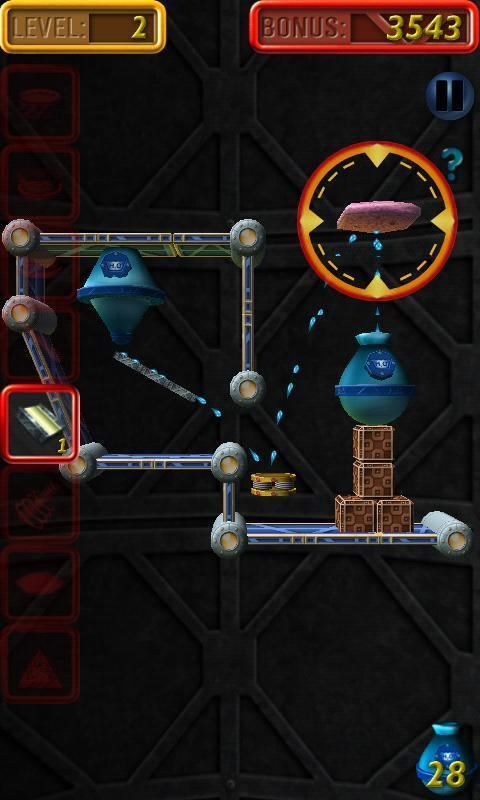
Find the location of a particular element. The width and height of the screenshot is (480, 800). pot is located at coordinates (115, 281), (366, 402), (447, 750).